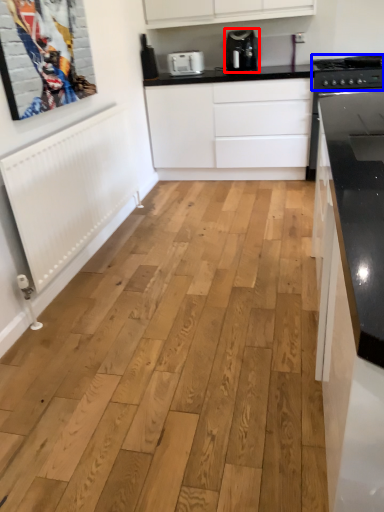
Question: Which of the following is the closest to the observer, home appliance (highlighted by a red box) or stove (highlighted by a blue box)?

Choices:
 (A) home appliance
 (B) stove

Answer: (B)